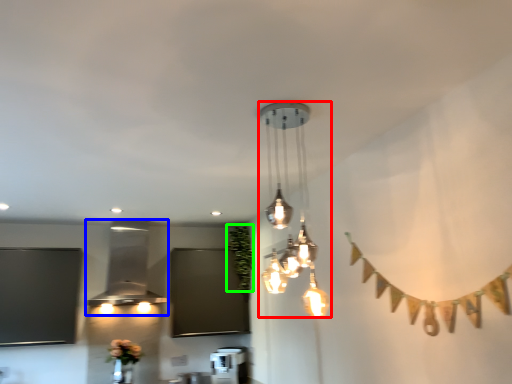
Question: Considering the real-world distances, which object is farthest from lamp (highlighted by a red box)? lamp (highlighted by a blue box) or plant (highlighted by a green box)?

Choices:
 (A) lamp
 (B) plant

Answer: (A)